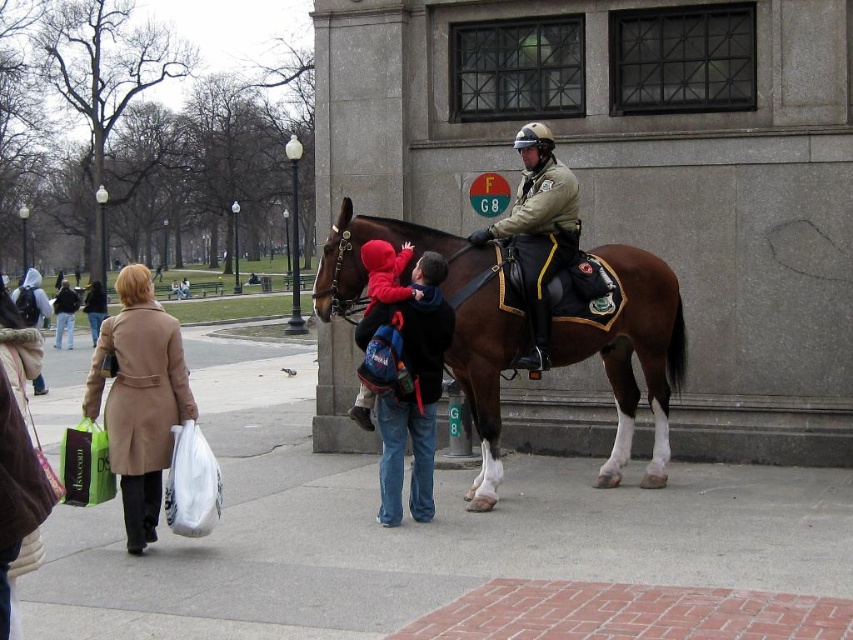
Question: Estimate the real-world distances between objects in this image. Which object is closer to the concrete sidewalk at lower center?

Choices:
 (A) velvety red jacket at center
 (B) brown glossy horse at center

Answer: (B)

Question: Which object is positioned closest to the matte brown uniform at center?

Choices:
 (A) velvety red jacket at center
 (B) beige wool coat at left
 (C) concrete sidewalk at lower center
 (D) brown glossy horse at center

Answer: (D)

Question: Which object is farther from the camera taking this photo?

Choices:
 (A) matte brown uniform at center
 (B) brown glossy horse at center
 (C) beige wool coat at left
 (D) concrete sidewalk at lower center

Answer: (B)

Question: Is concrete sidewalk at lower center to the left of brown glossy horse at center from the viewer's perspective?

Choices:
 (A) yes
 (B) no

Answer: (A)

Question: Is concrete sidewalk at lower center behind matte brown uniform at center?

Choices:
 (A) yes
 (B) no

Answer: (B)

Question: Considering the relative positions of concrete sidewalk at lower center and brown glossy horse at center in the image provided, where is concrete sidewalk at lower center located with respect to brown glossy horse at center?

Choices:
 (A) left
 (B) right

Answer: (A)